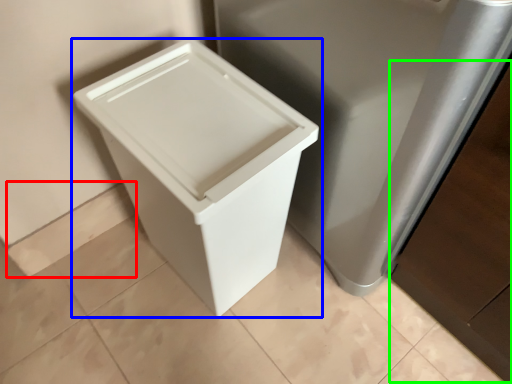
Question: Which is nearer to the square (highlighted by a red box)? waste container (highlighted by a blue box) or cabinetry (highlighted by a green box).

Choices:
 (A) waste container
 (B) cabinetry

Answer: (A)